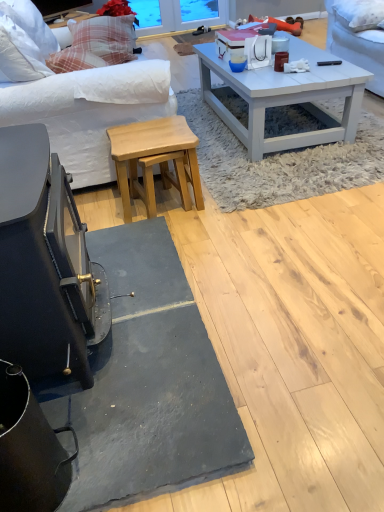
You are a GUI agent. You are given a task and a screenshot of the screen. Output one action in this format:
    pyautogui.click(x=<x>, y=<y>)
    Task: Click on the natural wood stool at center
    
    Given the screenshot: What is the action you would take?
    pyautogui.click(x=156, y=160)

At what (x,y) coordinates should I click in order to perform the action: click on white painted wood coffee table at center. Please return your answer as a coordinate pair (x, y). Looking at the image, I should click on (286, 97).

Describe the element at coordinates (279, 161) in the screenshot. I see `gray felt mat at center` at that location.

The height and width of the screenshot is (512, 384). Identify the location of plaid fabric pillow at upper left, marked as the 1th pillow in a left-to-right arrangement. (104, 38).

Image resolution: width=384 pixels, height=512 pixels. Identify the location of matte brown coffee cup at center, positioned as the second coffee cup in left-to-right order. (280, 61).

The image size is (384, 512). I want to click on natural wood stool at center, so click(x=156, y=160).

Measure the distance from white soft pillow at upper right, acting as the 1th pillow starting from the front, to matte black television at upper left.

A distance of 6.60 feet exists between white soft pillow at upper right, acting as the 1th pillow starting from the front, and matte black television at upper left.

Is white soft pillow at upper right, the 2th pillow from the top, beside matte black television at upper left?

No, white soft pillow at upper right, the 2th pillow from the top, is not in contact with matte black television at upper left.

From a real-world perspective, relative to matte black television at upper left, is white soft pillow at upper right, placed as the 1th pillow when sorted from right to left, vertically above or below?

From a real-world perspective, white soft pillow at upper right, placed as the 1th pillow when sorted from right to left, is physically below matte black television at upper left.

Is white soft pillow at upper right, the 1th pillow in the bottom-to-top sequence, looking in the opposite direction of matte black television at upper left?

No, white soft pillow at upper right, the 1th pillow in the bottom-to-top sequence,'s orientation is not away from matte black television at upper left.

Considering the relative positions of white soft pillow at upper right, the 2th pillow from the top, and plaid fabric pillow at upper left, the 1th pillow when ordered from top to bottom, in the image provided, is white soft pillow at upper right, the 2th pillow from the top, to the left or to the right of plaid fabric pillow at upper left, the 1th pillow when ordered from top to bottom,?

Based on their positions, white soft pillow at upper right, the 2th pillow from the top, is located to the right of plaid fabric pillow at upper left, the 1th pillow when ordered from top to bottom.

Is white soft pillow at upper right, placed as the 1th pillow when sorted from right to left, situated inside plaid fabric pillow at upper left, the 1th pillow when ordered from top to bottom, or outside?

white soft pillow at upper right, placed as the 1th pillow when sorted from right to left, exists outside the volume of plaid fabric pillow at upper left, the 1th pillow when ordered from top to bottom.

How many degrees apart are the facing directions of white soft pillow at upper right, acting as the 1th pillow starting from the front, and plaid fabric pillow at upper left, the second pillow when ordered from front to back?

102 degrees separate the facing orientations of white soft pillow at upper right, acting as the 1th pillow starting from the front, and plaid fabric pillow at upper left, the second pillow when ordered from front to back.

Who is bigger, white soft pillow at upper right, acting as the 1th pillow starting from the front, or plaid fabric pillow at upper left, marked as the 1th pillow in a left-to-right arrangement?

plaid fabric pillow at upper left, marked as the 1th pillow in a left-to-right arrangement, is bigger.

In the image, is white fabric cushion at upper left on the left side or the right side of plaid fabric pillow at upper left, which is the second pillow in right-to-left order?

white fabric cushion at upper left is positioned on plaid fabric pillow at upper left, which is the second pillow in right-to-left order,'s right side.

Is point (31, 106) closer or farther from the camera than point (89, 56)?

Point (31, 106) is positioned closer to the camera compared to point (89, 56).

Is the position of white fabric cushion at upper left less distant than that of plaid fabric pillow at upper left, which is the second pillow in right-to-left order?

A: Yes, white fabric cushion at upper left is in front of plaid fabric pillow at upper left, which is the second pillow in right-to-left order.

From the image's perspective, which pillow is the 2nd one above the white fabric cushion at upper left? Please provide its 2D coordinates.

[(104, 38)]

Is natural wood stool at center facing away from matte black television at upper left?

natural wood stool at center is not turned away from matte black television at upper left.

Which object is more forward, natural wood stool at center or matte black television at upper left?

natural wood stool at center is more forward.

From the picture: From a real-world perspective, is natural wood stool at center positioned over matte black television at upper left based on gravity?

No.

Visually, is natural wood stool at center positioned to the left or to the right of white painted wood coffee table at center?

natural wood stool at center is to the left of white painted wood coffee table at center.

Is natural wood stool at center shorter than white painted wood coffee table at center?

No.

From the image's perspective, who appears lower, natural wood stool at center or white painted wood coffee table at center?

natural wood stool at center appears lower in the image.

Is natural wood stool at center looking in the opposite direction of white painted wood coffee table at center?

natural wood stool at center does not have its back to white painted wood coffee table at center.

Is matte black television at upper left taller or shorter than matte blue cup at center, positioned as the 1th coffee cup in left-to-right order?

In the image, matte black television at upper left appears to be taller than matte blue cup at center, positioned as the 1th coffee cup in left-to-right order.

The width and height of the screenshot is (384, 512). I want to click on television behind the matte blue cup at center, positioned as the 2th coffee cup in right-to-left order, so click(x=59, y=7).

Could matte blue cup at center, positioned as the 1th coffee cup in left-to-right order, be considered to be inside matte black television at upper left?

Definitely not — matte blue cup at center, positioned as the 1th coffee cup in left-to-right order, is not inside matte black television at upper left.

Would you consider matte black television at upper left to be distant from matte blue cup at center, positioned as the 1th coffee cup in left-to-right order?

matte black television at upper left is far away from matte blue cup at center, positioned as the 1th coffee cup in left-to-right order.

Could white fabric cushion at upper left be considered to be inside white soft pillow at upper right, the 2th pillow from the top?

No, white fabric cushion at upper left is not surrounded by white soft pillow at upper right, the 2th pillow from the top.

From the picture: From the image's perspective, who appears lower, white soft pillow at upper right, the 2th pillow positioned from the left, or white fabric cushion at upper left?

white fabric cushion at upper left is shown below in the image.

How different are the orientations of white soft pillow at upper right, the 2th pillow from the top, and white fabric cushion at upper left in degrees?

The angle between the facing direction of white soft pillow at upper right, the 2th pillow from the top, and the facing direction of white fabric cushion at upper left is 168 degrees.

In the scene shown: Are white soft pillow at upper right, the 2th pillow from the top, and white fabric cushion at upper left making contact?

No, white soft pillow at upper right, the 2th pillow from the top, is not touching white fabric cushion at upper left.

Find the location of a particular element. The height and width of the screenshot is (512, 384). pillow below the matte black television at upper left (from the image's perspective) is located at coordinates (359, 13).

Find the location of `pillow that appears below the white soft pillow at upper right, the 2th pillow positioned from the back (from a real-world perspective)`. pillow that appears below the white soft pillow at upper right, the 2th pillow positioned from the back (from a real-world perspective) is located at coordinates (104, 38).

Looking at the image, which one is located closer to white fabric cushion at upper left, gray felt mat at center or natural wood stool at center?

Among the two, natural wood stool at center is located nearer to white fabric cushion at upper left.

Based on their spatial positions, is white fabric cushion at upper left or matte black television at upper left closer to matte brown coffee cup at center, positioned as the second coffee cup in left-to-right order?

Among the two, white fabric cushion at upper left is located nearer to matte brown coffee cup at center, positioned as the second coffee cup in left-to-right order.

Estimate the real-world distances between objects in this image. Which object is closer to gray felt mat at center, white fabric cushion at upper left or white painted wood coffee table at center?

white painted wood coffee table at center is closer to gray felt mat at center.

Based on their spatial positions, is matte brown coffee cup at center, positioned as the second coffee cup in left-to-right order, or white painted wood coffee table at center further from white fabric cushion at upper left?

matte brown coffee cup at center, positioned as the second coffee cup in left-to-right order, is further to white fabric cushion at upper left.

Looking at the image, which one is located closer to white painted wood coffee table at center, plaid fabric pillow at upper left, positioned as the 1th pillow in back-to-front order, or white fabric cushion at upper left?

white fabric cushion at upper left lies closer to white painted wood coffee table at center than the other object.

In the scene shown: When comparing their distances from natural wood stool at center, does matte blue cup at center, positioned as the 1th coffee cup in left-to-right order, or matte black television at upper left seem further?

Based on the image, matte black television at upper left appears to be further to natural wood stool at center.

From the image, which object appears to be farther from gray felt mat at center, white soft pillow at upper right, the 2th pillow positioned from the left, or matte brown coffee cup at center, the 1th coffee cup viewed from the right?

Based on the image, white soft pillow at upper right, the 2th pillow positioned from the left, appears to be further to gray felt mat at center.

Estimate the real-world distances between objects in this image. Which object is closer to natural wood stool at center, white painted wood coffee table at center or white fabric cushion at upper left?

white fabric cushion at upper left lies closer to natural wood stool at center than the other object.

What are the coordinates of `stool between white fabric cushion at upper left and matte blue cup at center, positioned as the 2th coffee cup in right-to-left order` in the screenshot? It's located at (156, 160).

Locate an element on the screen. pillow between natural wood stool at center and plaid fabric pillow at upper left, marked as the 1th pillow in a left-to-right arrangement, in the front-back direction is located at coordinates (359, 13).

At what (x,y) coordinates should I click in order to perform the action: click on mat between white fabric cushion at upper left and white soft pillow at upper right, the 2th pillow positioned from the left. Please return your answer as a coordinate pair (x, y). Looking at the image, I should click on (279, 161).

Identify the location of television between natural wood stool at center and plaid fabric pillow at upper left, marked as the 1th pillow in a left-to-right arrangement, along the z-axis. The image size is (384, 512). (59, 7).